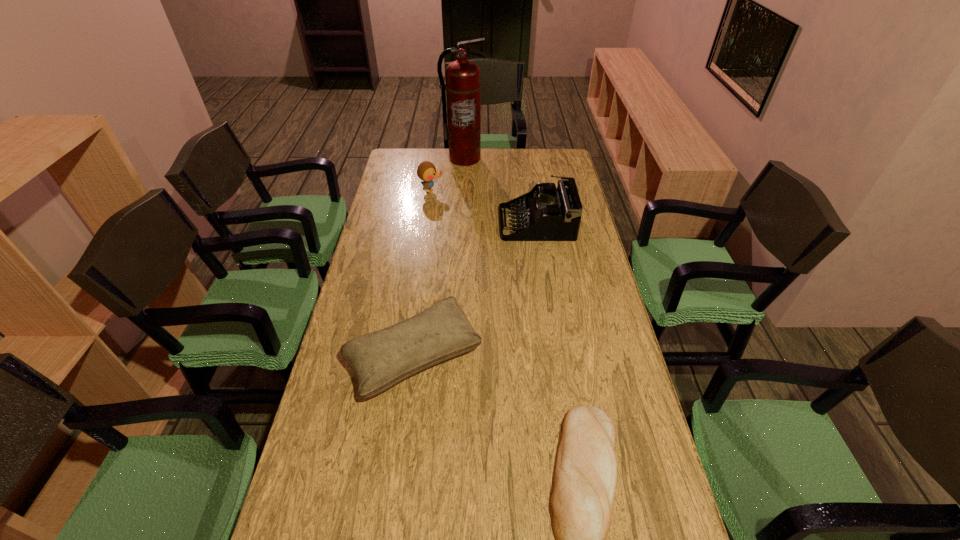
You are a GUI agent. You are given a task and a screenshot of the screen. Output one action in this format:
    pyautogui.click(x=<x>, y=<y>)
    Task: Click on the fire extinguisher
    The image size is (960, 540).
    Given the screenshot: What is the action you would take?
    pyautogui.click(x=463, y=77)

Where is `the tallest object`? This screenshot has width=960, height=540. the tallest object is located at coordinates (463, 77).

This screenshot has width=960, height=540. Identify the location of typewriter. (550, 214).

This screenshot has height=540, width=960. I want to click on duck, so 426,171.

This screenshot has width=960, height=540. Find the location of `the fourth farthest object`. the fourth farthest object is located at coordinates (380, 359).

Find the location of `vacant area situated 0.260m on the side of the tallest object with the handle and hose`. vacant area situated 0.260m on the side of the tallest object with the handle and hose is located at coordinates click(463, 198).

The width and height of the screenshot is (960, 540). What are the coordinates of `free space located 0.250m on the typing side of the third nearest object` in the screenshot? It's located at (437, 223).

Find the location of a particular element. Image resolution: width=960 pixels, height=540 pixels. vacant space located on the typing side of the third nearest object is located at coordinates (407, 223).

Find the location of a particular element. free space located on the typing side of the third nearest object is located at coordinates (421, 223).

Where is `free space located on the front-facing side of the duck`? The width and height of the screenshot is (960, 540). free space located on the front-facing side of the duck is located at coordinates (455, 191).